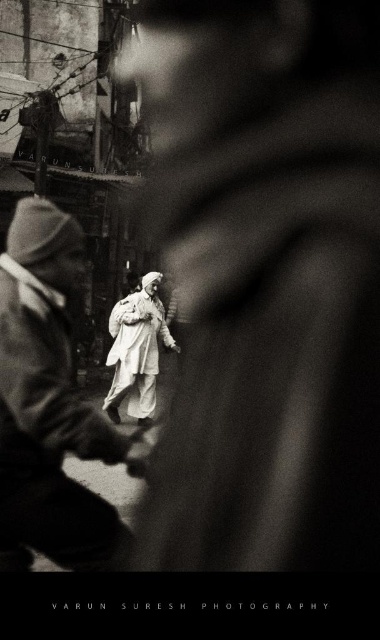
Question: Can you confirm if matte gray coat at center is smaller than white cotton dress at center?

Choices:
 (A) yes
 (B) no

Answer: (A)

Question: Can you confirm if matte gray coat at center is smaller than white cotton dress at center?

Choices:
 (A) no
 (B) yes

Answer: (B)

Question: Is the position of matte gray coat at center more distant than that of white cotton dress at center?

Choices:
 (A) no
 (B) yes

Answer: (A)

Question: Which object is farther from the camera taking this photo?

Choices:
 (A) white cotton dress at center
 (B) matte gray coat at center

Answer: (A)

Question: Which point is farther from the camera taking this photo?

Choices:
 (A) (38, 522)
 (B) (120, 300)

Answer: (B)

Question: Which point is farther to the camera?

Choices:
 (A) (49, 346)
 (B) (137, 369)

Answer: (B)